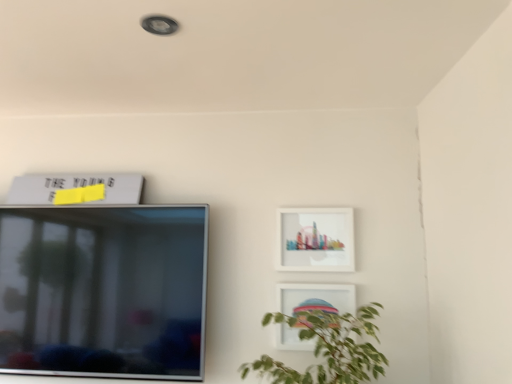
You are a GUI agent. You are given a task and a screenshot of the screen. Output one action in this format:
    pyautogui.click(x=<x>, y=<y>)
    Task: Click on the matte white picture frame at upper right, acting as the second picture frame starting from the bottom
    The width and height of the screenshot is (512, 384).
    Given the screenshot: What is the action you would take?
    pyautogui.click(x=315, y=239)

Considering the positions of points (329, 241) and (298, 299), is point (329, 241) farther from camera compared to point (298, 299)?

Yes, it is.

From the image's perspective, which one is positioned lower, matte white picture frame at upper right, acting as the second picture frame starting from the bottom, or white glossy picture frame at lower right, which is the 2th picture frame in left-to-right order?

white glossy picture frame at lower right, which is the 2th picture frame in left-to-right order.

I want to click on the 1st picture frame behind the white glossy picture frame at lower right, which appears as the second picture frame when viewed from the right, counting from the anchor's position, so click(x=315, y=239).

Is matte white picture frame at upper right, acting as the second picture frame starting from the bottom, surrounding white glossy picture frame at lower right, which appears as the second picture frame when viewed from the right?

No, white glossy picture frame at lower right, which appears as the second picture frame when viewed from the right, is not inside matte white picture frame at upper right, acting as the second picture frame starting from the bottom.

At what (x,y) coordinates should I click in order to perform the action: click on picture frame lying behind the matte white picture frame at upper right, arranged as the 2th picture frame when viewed from the top. Please return your answer as a coordinate pair (x, y). Image resolution: width=512 pixels, height=384 pixels. Looking at the image, I should click on (76, 188).

From the picture: Is white matte picture frame at upper left, marked as the 3th picture frame in a right-to-left arrangement, far from matte white picture frame at upper right, which is the first picture frame in right-to-left order?

No, there isn't a large distance between white matte picture frame at upper left, marked as the 3th picture frame in a right-to-left arrangement, and matte white picture frame at upper right, which is the first picture frame in right-to-left order.

Is white matte picture frame at upper left, marked as the 3th picture frame in a right-to-left arrangement, facing towards matte white picture frame at upper right, acting as the second picture frame starting from the bottom?

No, white matte picture frame at upper left, marked as the 3th picture frame in a right-to-left arrangement, is not turned towards matte white picture frame at upper right, acting as the second picture frame starting from the bottom.

Is white matte picture frame at upper left, the 3th picture frame from the bottom, to the left or to the right of matte white picture frame at upper right, acting as the second picture frame starting from the bottom, in the image?

Based on their positions, white matte picture frame at upper left, the 3th picture frame from the bottom, is located to the left of matte white picture frame at upper right, acting as the second picture frame starting from the bottom.

Considering the positions of objects white glossy picture frame at lower right, which appears as the third picture frame when viewed from the top, and matte white picture frame at upper right, acting as the second picture frame starting from the bottom, in the image provided, who is more to the left, white glossy picture frame at lower right, which appears as the third picture frame when viewed from the top, or matte white picture frame at upper right, acting as the second picture frame starting from the bottom,?

From the viewer's perspective, white glossy picture frame at lower right, which appears as the third picture frame when viewed from the top, appears more on the left side.

From the image's perspective, relative to matte white picture frame at upper right, acting as the second picture frame starting from the bottom, is white glossy picture frame at lower right, which appears as the second picture frame when viewed from the right, above or below?

white glossy picture frame at lower right, which appears as the second picture frame when viewed from the right, is situated lower than matte white picture frame at upper right, acting as the second picture frame starting from the bottom, in the image.

From a real-world perspective, which object stands above the other?

matte white picture frame at upper right, acting as the 3th picture frame starting from the left, is physically above.

Is white glossy picture frame at lower right, which appears as the second picture frame when viewed from the right, placed right next to matte white picture frame at upper right, which is the first picture frame in right-to-left order?

No, white glossy picture frame at lower right, which appears as the second picture frame when viewed from the right, is not with matte white picture frame at upper right, which is the first picture frame in right-to-left order.

Image resolution: width=512 pixels, height=384 pixels. I want to click on the 2nd picture frame directly beneath the white matte picture frame at upper left, marked as the 3th picture frame in a right-to-left arrangement (from a real-world perspective), so click(316, 297).

Consider the image. Is white matte picture frame at upper left, the 3th picture frame from the bottom, to the right of white glossy picture frame at lower right, the first picture frame in the bottom-to-top sequence, from the viewer's perspective?

No.

Is point (129, 175) in front of point (304, 305)?

No, (129, 175) is further to viewer.

Based on the photo, is matte white picture frame at upper right, acting as the second picture frame starting from the bottom, surrounding white matte picture frame at upper left, marked as the 3th picture frame in a right-to-left arrangement?

No, white matte picture frame at upper left, marked as the 3th picture frame in a right-to-left arrangement, is not inside matte white picture frame at upper right, acting as the second picture frame starting from the bottom.

Which object is positioned more to the right, matte white picture frame at upper right, acting as the second picture frame starting from the bottom, or white matte picture frame at upper left, the 1th picture frame in the top-to-bottom sequence?

matte white picture frame at upper right, acting as the second picture frame starting from the bottom, is more to the right.

From a real-world perspective, is matte white picture frame at upper right, arranged as the 2th picture frame when viewed from the top, located higher than white matte picture frame at upper left, marked as the 3th picture frame in a right-to-left arrangement?

No, from a real-world perspective, matte white picture frame at upper right, arranged as the 2th picture frame when viewed from the top, is not over white matte picture frame at upper left, marked as the 3th picture frame in a right-to-left arrangement

Is matte white picture frame at upper right, which is the first picture frame in right-to-left order, looking in the opposite direction of white matte picture frame at upper left, marked as the 3th picture frame in a right-to-left arrangement?

No.

Can you confirm if white glossy picture frame at lower right, which is the 2th picture frame in left-to-right order, is bigger than white matte picture frame at upper left, the 1th picture frame in the top-to-bottom sequence?

No.

Is white glossy picture frame at lower right, which is the 2th picture frame in left-to-right order, far from white matte picture frame at upper left, the 1th picture frame in the top-to-bottom sequence?

white glossy picture frame at lower right, which is the 2th picture frame in left-to-right order, is near white matte picture frame at upper left, the 1th picture frame in the top-to-bottom sequence, not far away.

You are a GUI agent. You are given a task and a screenshot of the screen. Output one action in this format:
    pyautogui.click(x=<x>, y=<y>)
    Task: Click on the picture frame that is the 2nd one when counting backward from the white glossy picture frame at lower right, which is the 2th picture frame in left-to-right order
    The height and width of the screenshot is (384, 512).
    Given the screenshot: What is the action you would take?
    pyautogui.click(x=76, y=188)

Is white glossy picture frame at lower right, which is the 2th picture frame in left-to-right order, oriented away from white matte picture frame at upper left, marked as the 1th picture frame in a left-to-right arrangement?

white glossy picture frame at lower right, which is the 2th picture frame in left-to-right order, does not have its back to white matte picture frame at upper left, marked as the 1th picture frame in a left-to-right arrangement.

At what (x,y) coordinates should I click in order to perform the action: click on picture frame in front of the matte white picture frame at upper right, arranged as the 2th picture frame when viewed from the top. Please return your answer as a coordinate pair (x, y). Looking at the image, I should click on (316, 297).

Find the location of a particular element. This screenshot has height=384, width=512. picture frame behind the matte white picture frame at upper right, which is the first picture frame in right-to-left order is located at coordinates coord(76,188).

Which object lies nearer to the anchor point white matte picture frame at upper left, marked as the 1th picture frame in a left-to-right arrangement, matte white picture frame at upper right, arranged as the 2th picture frame when viewed from the top, or white glossy picture frame at lower right, which appears as the third picture frame when viewed from the top?

Based on the image, matte white picture frame at upper right, arranged as the 2th picture frame when viewed from the top, appears to be nearer to white matte picture frame at upper left, marked as the 1th picture frame in a left-to-right arrangement.

From the image, which object appears to be nearer to white glossy picture frame at lower right, the first picture frame in the bottom-to-top sequence, white matte picture frame at upper left, marked as the 3th picture frame in a right-to-left arrangement, or matte white picture frame at upper right, arranged as the 2th picture frame when viewed from the top?

Based on the image, matte white picture frame at upper right, arranged as the 2th picture frame when viewed from the top, appears to be nearer to white glossy picture frame at lower right, the first picture frame in the bottom-to-top sequence.

From the image, which object appears to be farther from matte white picture frame at upper right, arranged as the 2th picture frame when viewed from the top, white glossy picture frame at lower right, which is the 2th picture frame in left-to-right order, or white matte picture frame at upper left, the 1th picture frame in the top-to-bottom sequence?

white matte picture frame at upper left, the 1th picture frame in the top-to-bottom sequence, is positioned further to the anchor matte white picture frame at upper right, arranged as the 2th picture frame when viewed from the top.

Looking at the image, which one is located closer to white glossy picture frame at lower right, which is the 2th picture frame in left-to-right order, matte white picture frame at upper right, acting as the second picture frame starting from the bottom, or white matte picture frame at upper left, marked as the 3th picture frame in a right-to-left arrangement?

The object closer to white glossy picture frame at lower right, which is the 2th picture frame in left-to-right order, is matte white picture frame at upper right, acting as the second picture frame starting from the bottom.

Which object lies nearer to the anchor point white matte picture frame at upper left, marked as the 3th picture frame in a right-to-left arrangement, white glossy picture frame at lower right, which is the 2th picture frame in left-to-right order, or matte white picture frame at upper right, which is the first picture frame in right-to-left order?

The object closer to white matte picture frame at upper left, marked as the 3th picture frame in a right-to-left arrangement, is matte white picture frame at upper right, which is the first picture frame in right-to-left order.

Estimate the real-world distances between objects in this image. Which object is further from matte white picture frame at upper right, acting as the 3th picture frame starting from the left, white matte picture frame at upper left, the 3th picture frame from the bottom, or white glossy picture frame at lower right, which is the 2th picture frame in left-to-right order?

Among the two, white matte picture frame at upper left, the 3th picture frame from the bottom, is located further to matte white picture frame at upper right, acting as the 3th picture frame starting from the left.

Locate an element on the screen. The height and width of the screenshot is (384, 512). picture frame between white matte picture frame at upper left, the 3th picture frame from the bottom, and matte white picture frame at upper right, acting as the second picture frame starting from the bottom is located at coordinates (316, 297).